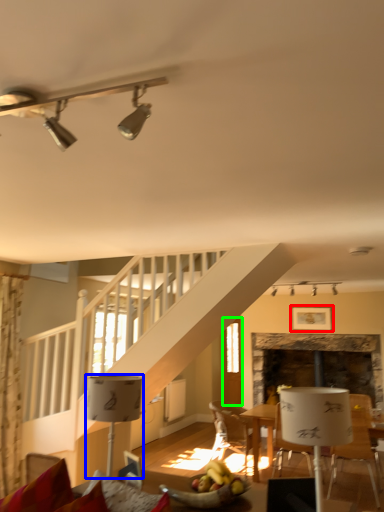
Question: Which object is positioned closest to picture frame (highlighted by a red box)? Select from lamp (highlighted by a blue box) and glass door (highlighted by a green box).

Choices:
 (A) lamp
 (B) glass door

Answer: (B)